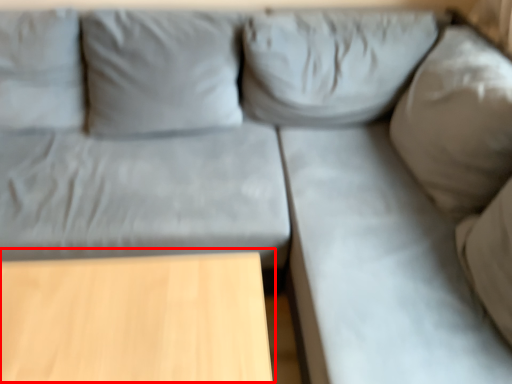
Question: In this image, where is table (annotated by the red box) located relative to sheet?

Choices:
 (A) right
 (B) left

Answer: (B)